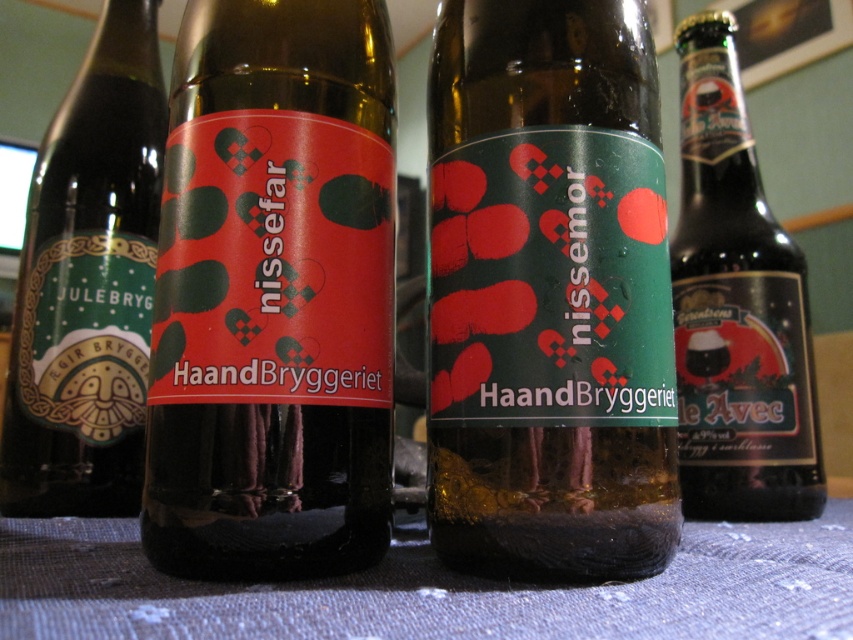
Which is below, green matte bottle at center or matte glass bottle at center?

green matte bottle at center is below.

Does point (589, 419) come farther from viewer compared to point (303, 380)?

No.

Locate an element on the screen. The image size is (853, 640). green matte bottle at center is located at coordinates (549, 292).

Which is below, matte glass bottle at center or green matte bottle at left?

Result: matte glass bottle at center

Is point (340, 504) closer to camera compared to point (57, 273)?

Yes, point (340, 504) is in front of point (57, 273).

This screenshot has width=853, height=640. Identify the location of matte glass bottle at center. (274, 294).

Based on the photo, who is positioned more to the right, green matte bottle at left or dark brown glass bottle at right?

dark brown glass bottle at right is more to the right.

Is point (148, 228) closer to camera compared to point (781, 362)?

That is True.

Locate an element on the screen. green matte bottle at left is located at coordinates (88, 284).